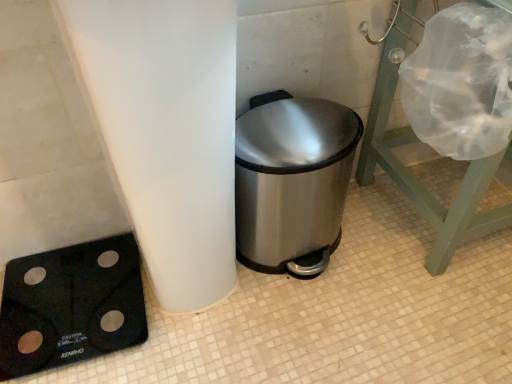
Question: Is black rubberized scale at lower left wider or thinner than stainless steel trash can at center?

Choices:
 (A) wide
 (B) thin

Answer: (A)

Question: From the image's perspective, is black rubberized scale at lower left positioned above or below stainless steel trash can at center?

Choices:
 (A) above
 (B) below

Answer: (B)

Question: Which object is the closest to the stainless steel trash can at center?

Choices:
 (A) black rubberized scale at lower left
 (B) transparent plastic shower cap at upper right

Answer: (B)

Question: Which of these objects is positioned closest to the stainless steel trash can at center?

Choices:
 (A) black rubberized scale at lower left
 (B) transparent plastic shower cap at upper right

Answer: (B)